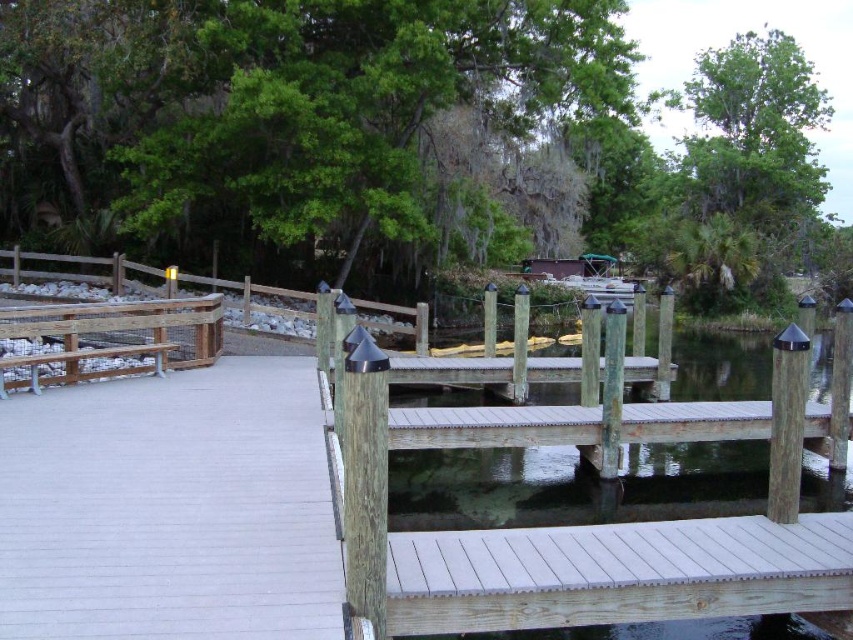
Which is more to the left, white wood dock at center or wooden bench at left?

wooden bench at left

In the scene shown: Between white wood dock at center and wooden bench at left, which one is positioned lower?

white wood dock at center is below.

Who is more forward, (647, 538) or (38, 384)?

Point (647, 538) is more forward.

This screenshot has height=640, width=853. What are the coordinates of `white wood dock at center` in the screenshot? It's located at (616, 573).